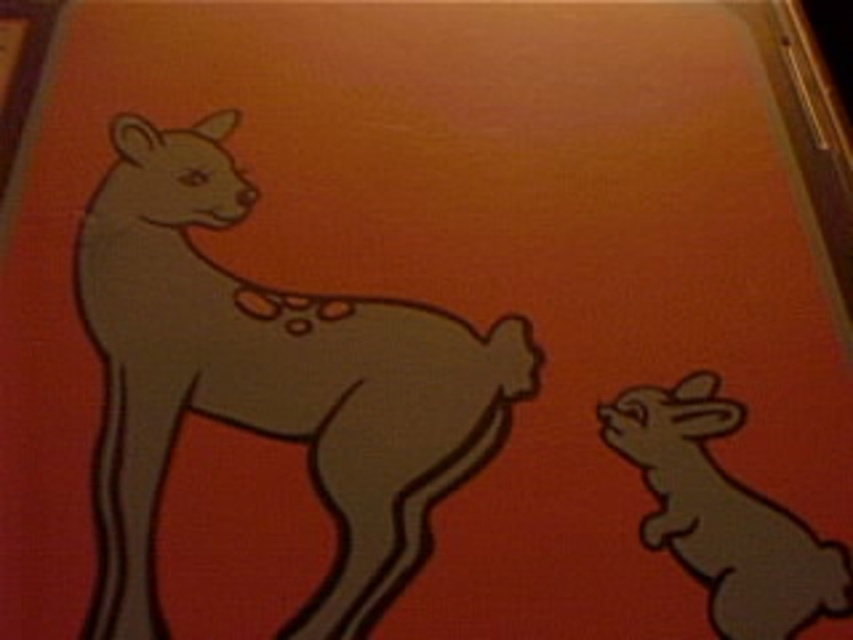
You are standing in front of the image and want to touch the two points shown. Which point, point (364, 388) or point (712, 554), is closer to your hand when you reach out?

Point (364, 388) is closer to your hand because it is further to the camera than point (712, 554).

You are an animal trainer standing in front of the matte brown kangaroo at left and the matte gray rabbit at lower right. Which animal do you need to step forward to reach first?

The matte brown kangaroo at left is closer to the viewer, so you need to step forward to reach it first before the matte gray rabbit at lower right.

You are a small toy measuring 2 inches wide that needs to place itself between the matte brown kangaroo at left and the matte gray rabbit at lower right. Can the toy fit in the space between them?

The distance between the matte brown kangaroo at left and the matte gray rabbit at lower right is 7.47 inches. Since the toy is only 2 inches wide, it can easily fit in the space between them.